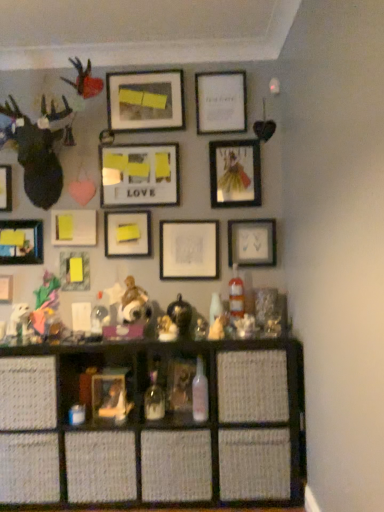
Question: Based on their sizes in the image, would you say matte black picture frame at upper center, the eighth picture frame in the left-to-right sequence, is bigger or smaller than matte black picture frame at left, acting as the 1th picture frame starting from the left?

Choices:
 (A) big
 (B) small

Answer: (A)

Question: Based on their positions, is matte black picture frame at upper center, the eighth picture frame in the left-to-right sequence, located to the left or right of matte black picture frame at left, acting as the 1th picture frame starting from the left?

Choices:
 (A) right
 (B) left

Answer: (A)

Question: Which object is positioned closest to the metallic gold picture frame at center right, placed as the 11th picture frame when sorted from left to right?

Choices:
 (A) matte glass picture frame at center-right, which appears as the 1th picture frame when viewed from the right
 (B) white paper at center, arranged as the 9th picture frame when viewed from the left
 (C) matte black picture frame at upper center, the eighth picture frame in the left-to-right sequence
 (D) metallic gold teapot at center, which ranks as the 2th toy in left-to-right order
 (E) white paper at upper center, the 10th picture frame positioned from the left

Answer: (E)

Question: Which object is positioned farthest from the yellow matte picture frame at lower left, acting as the fourth picture frame starting from the left?

Choices:
 (A) matte brown figurine at center, which is the first toy in left-to-right order
 (B) matte black picture frame at upper center, which is the fifth picture frame in right-to-left order
 (C) white paper at center, arranged as the 9th picture frame when viewed from the left
 (D) matte glass picture frame at center-right, which appears as the 1th picture frame when viewed from the right
 (E) matte black picture frame at left, placed as the second picture frame when sorted from left to right

Answer: (D)